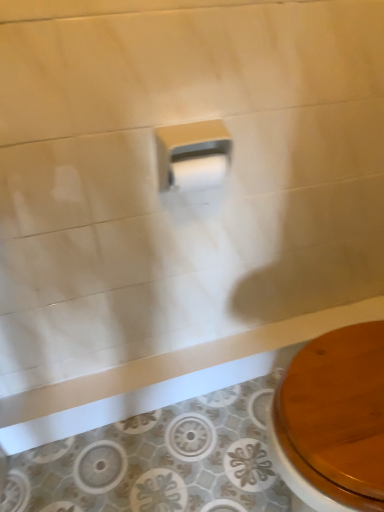
Describe the element at coordinates (193, 155) in the screenshot. The height and width of the screenshot is (512, 384). I see `white matte toilet paper at center, the second toilet paper in the bottom-to-top sequence` at that location.

How much space does white matte toilet paper at center, the second toilet paper in the bottom-to-top sequence, occupy horizontally?

white matte toilet paper at center, the second toilet paper in the bottom-to-top sequence, is 3.36 inches wide.

Locate an element on the screen. white matte toilet paper at center, the second toilet paper in the bottom-to-top sequence is located at coordinates (193, 155).

Identify the location of white glossy toilet paper at center, which ranks as the 2th toilet paper in top-to-bottom order. (198, 170).

The width and height of the screenshot is (384, 512). Describe the element at coordinates (198, 170) in the screenshot. I see `white glossy toilet paper at center, placed as the first toilet paper when sorted from bottom to top` at that location.

How much space does white glossy toilet paper at center, which ranks as the 2th toilet paper in top-to-bottom order, occupy horizontally?

The width of white glossy toilet paper at center, which ranks as the 2th toilet paper in top-to-bottom order, is 1.99 inches.

In order to face white glossy toilet paper at center, which ranks as the 2th toilet paper in top-to-bottom order, should I rotate leftwards or rightwards?

A 1.088 degree turn to the right will do.

Where is `white matte toilet paper at center, the second toilet paper in the bottom-to-top sequence`? The width and height of the screenshot is (384, 512). white matte toilet paper at center, the second toilet paper in the bottom-to-top sequence is located at coordinates (193, 155).

Based on their positions, is white glossy toilet paper at center, placed as the first toilet paper when sorted from bottom to top, located to the left or right of white matte toilet paper at center, the second toilet paper in the bottom-to-top sequence?

Based on their positions, white glossy toilet paper at center, placed as the first toilet paper when sorted from bottom to top, is located to the right of white matte toilet paper at center, the second toilet paper in the bottom-to-top sequence.

Does white glossy toilet paper at center, which ranks as the 2th toilet paper in top-to-bottom order, lie in front of white matte toilet paper at center, which ranks as the first toilet paper in top-to-bottom order?

No, white glossy toilet paper at center, which ranks as the 2th toilet paper in top-to-bottom order, is further to the viewer.

Considering the points (218, 162) and (190, 147), which point is behind, point (218, 162) or point (190, 147)?

The point (218, 162) is farther from the camera.

From the image's perspective, is white glossy toilet paper at center, which ranks as the 2th toilet paper in top-to-bottom order, beneath white matte toilet paper at center, which ranks as the first toilet paper in top-to-bottom order?

Yes, from the image's perspective, white glossy toilet paper at center, which ranks as the 2th toilet paper in top-to-bottom order, is below white matte toilet paper at center, which ranks as the first toilet paper in top-to-bottom order.

From a real-world perspective, does white glossy toilet paper at center, which ranks as the 2th toilet paper in top-to-bottom order, stand above white matte toilet paper at center, the second toilet paper in the bottom-to-top sequence?

No, from a real-world perspective, white glossy toilet paper at center, which ranks as the 2th toilet paper in top-to-bottom order, is not on top of white matte toilet paper at center, the second toilet paper in the bottom-to-top sequence.

Which object is wider, white glossy toilet paper at center, placed as the first toilet paper when sorted from bottom to top, or white matte toilet paper at center, the second toilet paper in the bottom-to-top sequence?

white matte toilet paper at center, the second toilet paper in the bottom-to-top sequence.

Does white glossy toilet paper at center, placed as the first toilet paper when sorted from bottom to top, have a lesser height compared to white matte toilet paper at center, which ranks as the first toilet paper in top-to-bottom order?

Yes, white glossy toilet paper at center, placed as the first toilet paper when sorted from bottom to top, is shorter than white matte toilet paper at center, which ranks as the first toilet paper in top-to-bottom order.

Considering the sizes of objects white glossy toilet paper at center, which ranks as the 2th toilet paper in top-to-bottom order, and white matte toilet paper at center, which ranks as the first toilet paper in top-to-bottom order, in the image provided, who is bigger, white glossy toilet paper at center, which ranks as the 2th toilet paper in top-to-bottom order, or white matte toilet paper at center, which ranks as the first toilet paper in top-to-bottom order,?

Bigger between the two is white matte toilet paper at center, which ranks as the first toilet paper in top-to-bottom order.

Is white glossy toilet paper at center, placed as the first toilet paper when sorted from bottom to top, outside of white matte toilet paper at center, the second toilet paper in the bottom-to-top sequence?

No, most part of white glossy toilet paper at center, placed as the first toilet paper when sorted from bottom to top, lies within white matte toilet paper at center, the second toilet paper in the bottom-to-top sequence.

Is white glossy toilet paper at center, placed as the first toilet paper when sorted from bottom to top, far from white matte toilet paper at center, the second toilet paper in the bottom-to-top sequence?

They are positioned close to each other.

Is white glossy toilet paper at center, placed as the first toilet paper when sorted from bottom to top, oriented towards white matte toilet paper at center, which ranks as the first toilet paper in top-to-bottom order?

Yes, white glossy toilet paper at center, placed as the first toilet paper when sorted from bottom to top, is oriented towards white matte toilet paper at center, which ranks as the first toilet paper in top-to-bottom order.

What's the angular difference between white glossy toilet paper at center, which ranks as the 2th toilet paper in top-to-bottom order, and white matte toilet paper at center, the second toilet paper in the bottom-to-top sequence,'s facing directions?

There is a 1.89-degree angle between the facing directions of white glossy toilet paper at center, which ranks as the 2th toilet paper in top-to-bottom order, and white matte toilet paper at center, the second toilet paper in the bottom-to-top sequence.

I want to click on toilet paper above the white glossy toilet paper at center, placed as the first toilet paper when sorted from bottom to top (from the image's perspective), so click(193, 155).

Which is more to the left, white matte toilet paper at center, the second toilet paper in the bottom-to-top sequence, or white glossy toilet paper at center, which ranks as the 2th toilet paper in top-to-bottom order?

Positioned to the left is white matte toilet paper at center, the second toilet paper in the bottom-to-top sequence.

Between white matte toilet paper at center, which ranks as the first toilet paper in top-to-bottom order, and white glossy toilet paper at center, which ranks as the 2th toilet paper in top-to-bottom order, which one is positioned in front?

Positioned in front is white matte toilet paper at center, which ranks as the first toilet paper in top-to-bottom order.

Which is closer to the camera, (204,123) or (193,160)?

Clearly, point (204,123) is more distant from the camera than point (193,160).

From the image's perspective, which one is positioned higher, white matte toilet paper at center, the second toilet paper in the bottom-to-top sequence, or white glossy toilet paper at center, placed as the first toilet paper when sorted from bottom to top?

white matte toilet paper at center, the second toilet paper in the bottom-to-top sequence.

From a real-world perspective, who is located lower, white matte toilet paper at center, the second toilet paper in the bottom-to-top sequence, or white glossy toilet paper at center, which ranks as the 2th toilet paper in top-to-bottom order?

In real-world perspective, white glossy toilet paper at center, which ranks as the 2th toilet paper in top-to-bottom order, is lower.

Does white matte toilet paper at center, which ranks as the first toilet paper in top-to-bottom order, have a greater width compared to white glossy toilet paper at center, placed as the first toilet paper when sorted from bottom to top?

Yes, white matte toilet paper at center, which ranks as the first toilet paper in top-to-bottom order, is wider than white glossy toilet paper at center, placed as the first toilet paper when sorted from bottom to top.

Between white matte toilet paper at center, the second toilet paper in the bottom-to-top sequence, and white glossy toilet paper at center, placed as the first toilet paper when sorted from bottom to top, which one has more height?

With more height is white matte toilet paper at center, the second toilet paper in the bottom-to-top sequence.

Does white matte toilet paper at center, the second toilet paper in the bottom-to-top sequence, have a larger size compared to white glossy toilet paper at center, which ranks as the 2th toilet paper in top-to-bottom order?

Yes, white matte toilet paper at center, the second toilet paper in the bottom-to-top sequence, is bigger than white glossy toilet paper at center, which ranks as the 2th toilet paper in top-to-bottom order.

Would you say white glossy toilet paper at center, placed as the first toilet paper when sorted from bottom to top, is part of white matte toilet paper at center, which ranks as the first toilet paper in top-to-bottom order,'s contents?

Yes, white matte toilet paper at center, which ranks as the first toilet paper in top-to-bottom order, contains white glossy toilet paper at center, placed as the first toilet paper when sorted from bottom to top.

Is white matte toilet paper at center, the second toilet paper in the bottom-to-top sequence, with white glossy toilet paper at center, placed as the first toilet paper when sorted from bottom to top?

Absolutely, white matte toilet paper at center, the second toilet paper in the bottom-to-top sequence, is next to and touching white glossy toilet paper at center, placed as the first toilet paper when sorted from bottom to top.

Is white matte toilet paper at center, which ranks as the first toilet paper in top-to-bottom order, positioned with its back to white glossy toilet paper at center, which ranks as the 2th toilet paper in top-to-bottom order?

Yes, white glossy toilet paper at center, which ranks as the 2th toilet paper in top-to-bottom order, is at the back of white matte toilet paper at center, which ranks as the first toilet paper in top-to-bottom order.

Can you tell me how much white matte toilet paper at center, which ranks as the first toilet paper in top-to-bottom order, and white glossy toilet paper at center, placed as the first toilet paper when sorted from bottom to top, differ in facing direction?

There is a 1.89-degree angle between the facing directions of white matte toilet paper at center, which ranks as the first toilet paper in top-to-bottom order, and white glossy toilet paper at center, placed as the first toilet paper when sorted from bottom to top.

How far apart are white matte toilet paper at center, which ranks as the first toilet paper in top-to-bottom order, and white glossy toilet paper at center, placed as the first toilet paper when sorted from bottom to top?

The distance of white matte toilet paper at center, which ranks as the first toilet paper in top-to-bottom order, from white glossy toilet paper at center, placed as the first toilet paper when sorted from bottom to top, is 1.83 centimeters.

Locate an element on the screen. This screenshot has width=384, height=512. toilet paper on the right of white matte toilet paper at center, the second toilet paper in the bottom-to-top sequence is located at coordinates (198, 170).

Locate an element on the screen. The image size is (384, 512). toilet paper that is behind the white matte toilet paper at center, which ranks as the first toilet paper in top-to-bottom order is located at coordinates (198, 170).

I want to click on toilet paper above the white glossy toilet paper at center, which ranks as the 2th toilet paper in top-to-bottom order (from a real-world perspective), so click(193, 155).